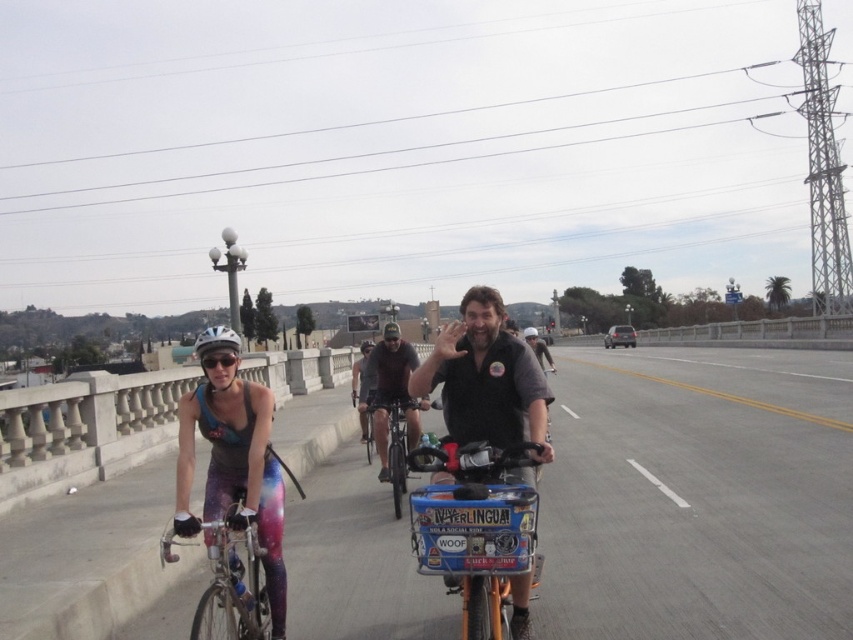
You are a cyclist on the bridge and want to know if the point at coordinate point [606,396] is ahead or behind the point at coordinate point [361,412]. Based on the scene, which direction is it?

The point at coordinate point [606,396] is behind point at coordinate point [361,412].

What are the coordinates of the gray asphalt highway at center in the image?

The gray asphalt highway at center is located at coordinates point (699, 496).